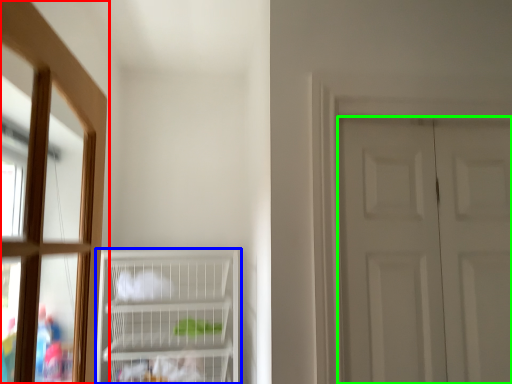
Question: Which object is positioned farthest from window (highlighted by a red box)? Select from cupboard (highlighted by a blue box) and door (highlighted by a green box).

Choices:
 (A) cupboard
 (B) door

Answer: (B)